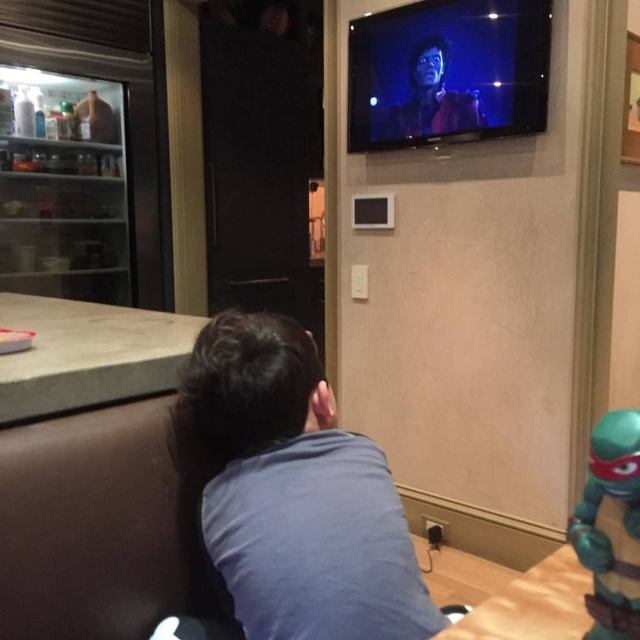
You are a delivery person who needs to place a small package on the teal plastic turtle at lower right. However, the shiny red leather jacket at upper center is blocking the path. Can you place the package there without moving the jacket?

The teal plastic turtle at lower right is in front of the shiny red leather jacket at upper center, so you can place the package on the teal plastic turtle at lower right without moving the jacket since it is already positioned in front of the jacket.

You are organizing a closet and see the blue cotton shirt at center and the teal plastic turtle at lower right. Which item is located more to the left?

The blue cotton shirt at center is positioned more to the left than the teal plastic turtle at lower right.

You are a delivery person who needs to place a small package between the blue cotton shirt at center and the teal plastic turtle at lower right. The package is 19 inches long. Can you fit it between them without moving either object?

The blue cotton shirt at center is 18.88 inches away from the teal plastic turtle at lower right. Since the package is 19 inches long, which is slightly longer than the distance between them, it cannot be placed between the two objects without moving either object.